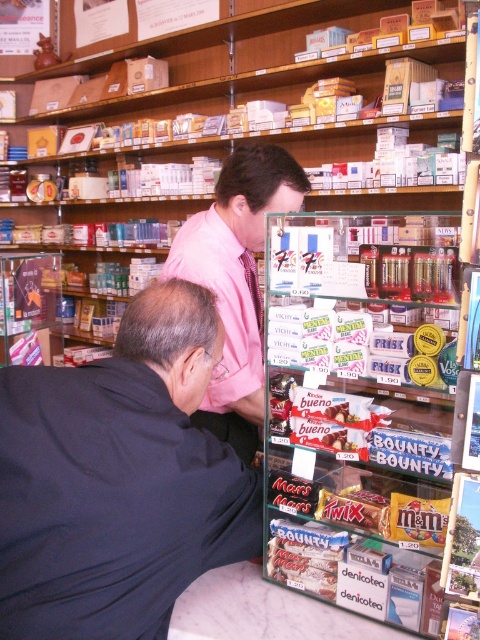
In the scene shown: Who is shorter, pink shirt at center or pink woven tie at center?

Standing shorter between the two is pink woven tie at center.

Who is more distant from viewer, (212, 392) or (251, 282)?

The point (251, 282) is behind.

Locate an element on the screen. The height and width of the screenshot is (640, 480). pink shirt at center is located at coordinates (236, 280).

Who is taller, black matte jacket at lower left or pink satin dress shirt at upper center?

black matte jacket at lower left is taller.

Does black matte jacket at lower left have a larger size compared to pink satin dress shirt at upper center?

Indeed, black matte jacket at lower left has a larger size compared to pink satin dress shirt at upper center.

The image size is (480, 640). What do you see at coordinates (119, 480) in the screenshot? I see `black matte jacket at lower left` at bounding box center [119, 480].

I want to click on black matte jacket at lower left, so click(x=119, y=480).

Does black matte jacket at lower left come in front of pink woven tie at center?

A: Yes, it is.

Is point (83, 548) closer to viewer compared to point (260, 326)?

Yes, point (83, 548) is closer to viewer.

Measure the distance between point (105, 556) and camera.

They are 77.94 centimeters apart.

The image size is (480, 640). I want to click on black matte jacket at lower left, so click(x=119, y=480).